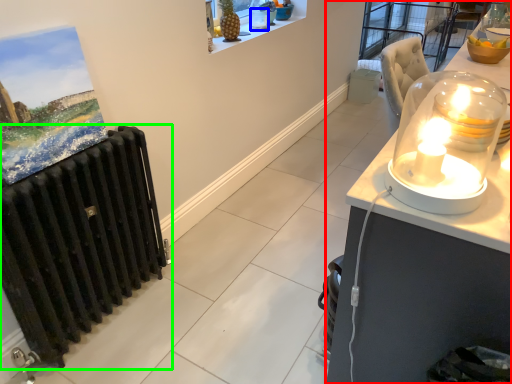
Question: Which object is the closest to the desk (highlighted by a red box)? Choose among these: candle holder (highlighted by a blue box) or radiator (highlighted by a green box).

Choices:
 (A) candle holder
 (B) radiator

Answer: (B)